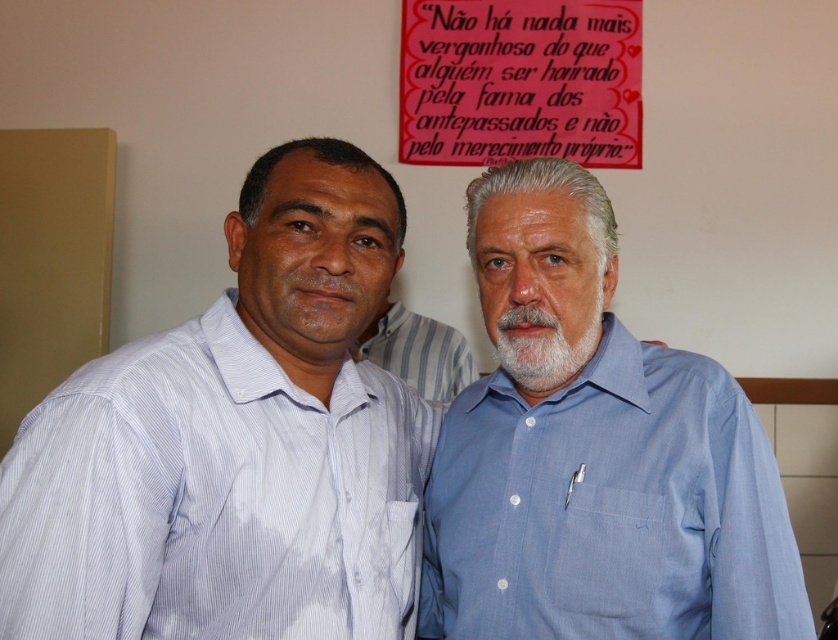
Is blue cotton shirt at right positioned before matte red poster at upper center?

That is True.

Who is shorter, blue cotton shirt at right or matte red poster at upper center?

Standing shorter between the two is matte red poster at upper center.

Is point (542, 273) positioned before point (402, 147)?

Yes, it is in front of point (402, 147).

I want to click on blue cotton shirt at right, so click(593, 452).

Which is below, white striped shirt at left or striped cotton shirt at center?

white striped shirt at left is lower down.

Who is positioned more to the right, white striped shirt at left or striped cotton shirt at center?

striped cotton shirt at center

Is point (244, 580) positioned after point (446, 342)?

No, it is in front of (446, 342).

Identify the location of white striped shirt at left. Image resolution: width=838 pixels, height=640 pixels. (213, 497).

Where is `white striped shirt at left`? This screenshot has height=640, width=838. white striped shirt at left is located at coordinates (213, 497).

Is white striped shirt at left above white soft beard at center?

No.

Is point (242, 604) positioned before point (516, 372)?

Yes, it is.

The image size is (838, 640). What are the coordinates of `white striped shirt at left` in the screenshot? It's located at (213, 497).